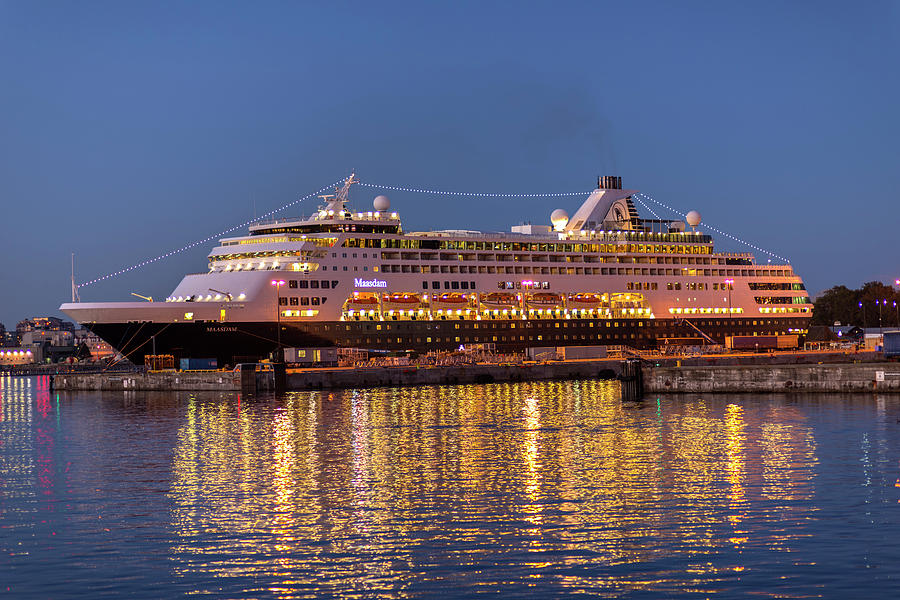
Identify the location of string lights. (185, 246), (453, 196), (644, 205), (743, 238), (670, 205).